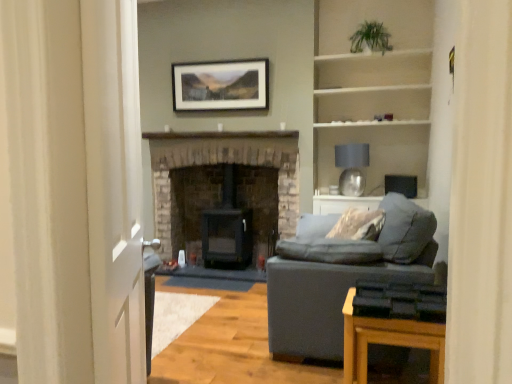
Locate an element on the screen. Image resolution: width=512 pixels, height=384 pixels. matte black picture frame at upper center is located at coordinates (221, 85).

What do you see at coordinates (372, 103) in the screenshot? The image size is (512, 384). I see `white wooden shelves at upper right` at bounding box center [372, 103].

Identify the location of white glossy door at left. (114, 188).

Locate an element on the screen. This screenshot has width=512, height=384. brick fireplace at center, arranged as the 1th fireplace when viewed from the left is located at coordinates (223, 162).

Describe the element at coordinates (352, 167) in the screenshot. The width and height of the screenshot is (512, 384). I see `satin silver lampshade at upper right` at that location.

The width and height of the screenshot is (512, 384). I want to click on wooden table at lower right, so click(388, 341).

At what (x,y) coordinates should I click in order to perform the action: click on matte black picture frame at upper center. Please return your answer as a coordinate pair (x, y). Looking at the image, I should click on (221, 85).

Is point (346, 91) closer or farther from the camera than point (206, 69)?

Clearly, point (346, 91) is closer to the camera than point (206, 69).

The width and height of the screenshot is (512, 384). Identify the location of picture frame above the white wooden shelves at upper right (from the image's perspective). (221, 85).

From the image's perspective, is white wooden shelves at upper right below matte black picture frame at upper center?

Indeed, from the image's perspective, white wooden shelves at upper right is shown beneath matte black picture frame at upper center.

Considering the positions of objects white wooden shelves at upper right and matte black picture frame at upper center in the image provided, who is more to the left, white wooden shelves at upper right or matte black picture frame at upper center?

matte black picture frame at upper center is more to the left.

Which is correct: black matte fireplace at center, positioned as the second fireplace in left-to-right order, is inside white wooden shelves at upper right, or outside of it?

The correct answer is: outside.

From the image's perspective, which one is positioned lower, black matte fireplace at center, which ranks as the first fireplace in right-to-left order, or white wooden shelves at upper right?

black matte fireplace at center, which ranks as the first fireplace in right-to-left order, from the image's perspective.

Considering the sizes of objects black matte fireplace at center, which ranks as the first fireplace in right-to-left order, and white wooden shelves at upper right in the image provided, who is shorter, black matte fireplace at center, which ranks as the first fireplace in right-to-left order, or white wooden shelves at upper right?

With less height is white wooden shelves at upper right.

Considering the relative sizes of black matte fireplace at center, which ranks as the first fireplace in right-to-left order, and white wooden shelves at upper right in the image provided, is black matte fireplace at center, which ranks as the first fireplace in right-to-left order, bigger than white wooden shelves at upper right?

No, black matte fireplace at center, which ranks as the first fireplace in right-to-left order, is not bigger than white wooden shelves at upper right.

Identify the location of fireplace that is the 1st object directly below the satin silver lampshade at upper right (from a real-world perspective). The image size is (512, 384). (223, 162).

From the image's perspective, which object appears higher, brick fireplace at center, arranged as the 1th fireplace when viewed from the left, or satin silver lampshade at upper right?

satin silver lampshade at upper right.

Is brick fireplace at center, positioned as the second fireplace in right-to-left order, turned away from satin silver lampshade at upper right?

brick fireplace at center, positioned as the second fireplace in right-to-left order, is not turned away from satin silver lampshade at upper right.

Which is more to the right, brick fireplace at center, arranged as the 1th fireplace when viewed from the left, or satin silver lampshade at upper right?

satin silver lampshade at upper right is more to the right.

Can we say brick fireplace at center, positioned as the second fireplace in right-to-left order, lies outside matte black picture frame at upper center?

brick fireplace at center, positioned as the second fireplace in right-to-left order, lies outside matte black picture frame at upper center's area.

From the picture: Looking at the image, does brick fireplace at center, positioned as the second fireplace in right-to-left order, seem bigger or smaller compared to matte black picture frame at upper center?

brick fireplace at center, positioned as the second fireplace in right-to-left order, is bigger than matte black picture frame at upper center.

From a real-world perspective, who is located higher, brick fireplace at center, arranged as the 1th fireplace when viewed from the left, or matte black picture frame at upper center?

In real-world perspective, matte black picture frame at upper center is above.

Which object is thinner, matte black picture frame at upper center or white wooden shelves at upper right?

Thinner between the two is matte black picture frame at upper center.

Where is `shelf below the matte black picture frame at upper center (from the image's perspective)`? The image size is (512, 384). shelf below the matte black picture frame at upper center (from the image's perspective) is located at coordinates pos(372,103).

Do you think matte black picture frame at upper center is within white wooden shelves at upper right, or outside of it?

matte black picture frame at upper center cannot be found inside white wooden shelves at upper right.

Which of these two, matte black picture frame at upper center or white wooden shelves at upper right, is smaller?

matte black picture frame at upper center is smaller.

How many degrees apart are the facing directions of white glossy door at left and matte gray fabric couch at right?

159 degrees separate the facing orientations of white glossy door at left and matte gray fabric couch at right.

Is there a large distance between white glossy door at left and matte gray fabric couch at right?

white glossy door at left is far away from matte gray fabric couch at right.

Which object is further away from the camera, white glossy door at left or matte gray fabric couch at right?

matte gray fabric couch at right is more distant.

Can we say white glossy door at left lies outside matte gray fabric couch at right?

Yes, white glossy door at left is not within matte gray fabric couch at right.

Is white wooden shelves at upper right taller than satin silver lampshade at upper right?

Yes.

Is white wooden shelves at upper right next to satin silver lampshade at upper right?

white wooden shelves at upper right and satin silver lampshade at upper right are not in contact.

From the picture: Considering the positions of objects white wooden shelves at upper right and satin silver lampshade at upper right in the image provided, who is behind, white wooden shelves at upper right or satin silver lampshade at upper right?

satin silver lampshade at upper right is more distant.

I want to click on picture frame above the white wooden shelves at upper right (from the image's perspective), so click(x=221, y=85).

The width and height of the screenshot is (512, 384). What are the coordinates of `the 2nd fireplace behind the white wooden shelves at upper right` in the screenshot? It's located at (192, 200).

Which object lies nearer to the anchor point wooden table at lower right, matte gray fabric couch at right or matte black picture frame at upper center?

matte gray fabric couch at right.

Considering their positions, is white wooden shelves at upper right positioned further to white glossy door at left than matte black picture frame at upper center?

Among the two, white wooden shelves at upper right is located further to white glossy door at left.

Considering their positions, is wooden table at lower right positioned further to matte black picture frame at upper center than matte gray fabric couch at right?

wooden table at lower right.

Looking at this image, from the image, which object appears to be farther from white wooden shelves at upper right, wooden table at lower right or black matte fireplace at center, which ranks as the first fireplace in right-to-left order?

The object further to white wooden shelves at upper right is wooden table at lower right.

Estimate the real-world distances between objects in this image. Which object is closer to brick fireplace at center, arranged as the 1th fireplace when viewed from the left, matte gray fabric couch at right or white wooden shelves at upper right?

white wooden shelves at upper right.

From the image, which object appears to be nearer to white glossy door at left, green leafy plant at upper right or matte gray fabric couch at right?

Based on the image, matte gray fabric couch at right appears to be nearer to white glossy door at left.

When comparing their distances from satin silver lampshade at upper right, does matte gray fabric couch at right or black matte fireplace at center, positioned as the second fireplace in left-to-right order, seem further?

matte gray fabric couch at right is further to satin silver lampshade at upper right.

Estimate the real-world distances between objects in this image. Which object is closer to black matte fireplace at center, which ranks as the first fireplace in right-to-left order, wooden table at lower right or green leafy plant at upper right?

green leafy plant at upper right lies closer to black matte fireplace at center, which ranks as the first fireplace in right-to-left order, than the other object.

Find the location of a particular element. Image resolution: width=512 pixels, height=384 pixels. table between white glossy door at left and green leafy plant at upper right along the z-axis is located at coordinates (388, 341).

Where is `plant positioned between white glossy door at left and brick fireplace at center, arranged as the 1th fireplace when viewed from the left, from near to far`? The image size is (512, 384). plant positioned between white glossy door at left and brick fireplace at center, arranged as the 1th fireplace when viewed from the left, from near to far is located at coordinates (370, 38).

The width and height of the screenshot is (512, 384). Identify the location of lamp located between black matte fireplace at center, which ranks as the first fireplace in right-to-left order, and white wooden shelves at upper right in the left-right direction. (352, 167).

Locate an element on the screen. This screenshot has width=512, height=384. studio couch located between wooden table at lower right and brick fireplace at center, arranged as the 1th fireplace when viewed from the left, in the depth direction is located at coordinates (342, 279).